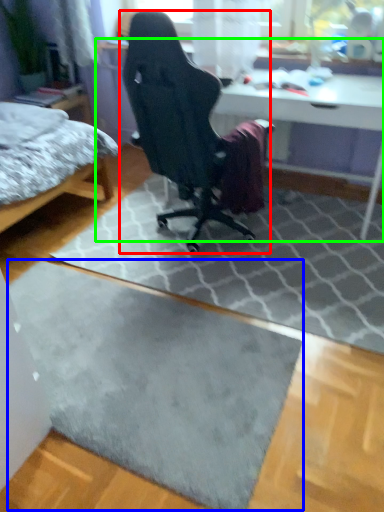
Question: Which object is positioned farthest from chair (highlighted by a red box)? Select from doormat (highlighted by a blue box) and table (highlighted by a green box).

Choices:
 (A) doormat
 (B) table

Answer: (A)